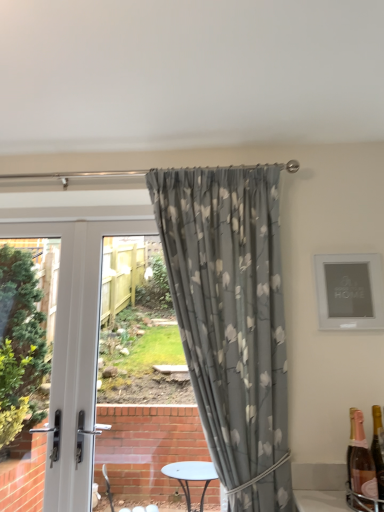
Question: Is gray floral fabric curtain at center to the left of white glossy door at left from the viewer's perspective?

Choices:
 (A) yes
 (B) no

Answer: (B)

Question: Can you confirm if gray floral fabric curtain at center is smaller than white glossy door at left?

Choices:
 (A) yes
 (B) no

Answer: (B)

Question: From the image's perspective, is gray floral fabric curtain at center located above white glossy door at left?

Choices:
 (A) no
 (B) yes

Answer: (B)

Question: Is gray floral fabric curtain at center positioned in front of white glossy door at left?

Choices:
 (A) yes
 (B) no

Answer: (A)

Question: Would you say white glossy door at left is part of gray floral fabric curtain at center's contents?

Choices:
 (A) yes
 (B) no

Answer: (B)

Question: Would you say gray floral fabric curtain at center is to the left or to the right of pink glass bottle at lower right, placed as the 2th bottle when sorted from left to right, in the picture?

Choices:
 (A) left
 (B) right

Answer: (A)

Question: Is gray floral fabric curtain at center spatially inside pink glass bottle at lower right, which is counted as the 1th bottle, starting from the back, or outside of it?

Choices:
 (A) inside
 (B) outside

Answer: (B)

Question: From the image's perspective, is gray floral fabric curtain at center positioned above or below pink glass bottle at lower right, which is counted as the 1th bottle, starting from the back?

Choices:
 (A) above
 (B) below

Answer: (A)

Question: Looking at the image, does gray floral fabric curtain at center seem bigger or smaller compared to pink glass bottle at lower right, placed as the 1th bottle when sorted from right to left?

Choices:
 (A) big
 (B) small

Answer: (A)

Question: Considering the positions of point (258, 210) and point (364, 284), is point (258, 210) closer or farther from the camera than point (364, 284)?

Choices:
 (A) closer
 (B) farther

Answer: (B)

Question: From their relative heights in the image, would you say gray floral fabric curtain at center is taller or shorter than matte silver picture frame at upper right?

Choices:
 (A) tall
 (B) short

Answer: (A)

Question: From the image's perspective, is gray floral fabric curtain at center positioned above or below matte silver picture frame at upper right?

Choices:
 (A) above
 (B) below

Answer: (B)

Question: From a real-world perspective, is gray floral fabric curtain at center physically located above or below matte silver picture frame at upper right?

Choices:
 (A) above
 (B) below

Answer: (B)

Question: Is gold metallic bottle at lower right, which is counted as the 2th bottle, starting from the back, in front of or behind white glossy door at left in the image?

Choices:
 (A) behind
 (B) front

Answer: (B)

Question: Is gold metallic bottle at lower right, the 2th bottle when ordered from right to left, inside the boundaries of white glossy door at left, or outside?

Choices:
 (A) inside
 (B) outside

Answer: (B)